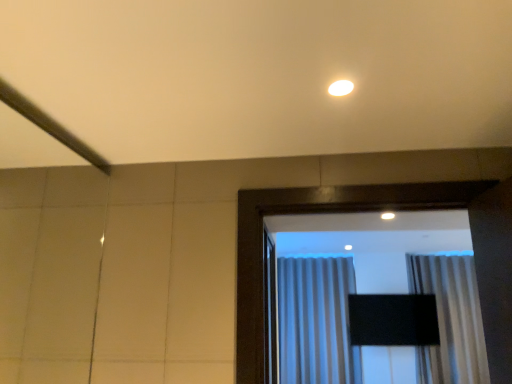
Question: From a real-world perspective, is white glossy light fixture at upper center on gray textured curtain at center, placed as the second curtain when sorted from right to left?

Choices:
 (A) no
 (B) yes

Answer: (B)

Question: Is white glossy light fixture at upper center facing towards gray textured curtain at center, placed as the second curtain when sorted from right to left?

Choices:
 (A) yes
 (B) no

Answer: (B)

Question: Can you confirm if white glossy light fixture at upper center is shorter than gray textured curtain at center, the first curtain from the left?

Choices:
 (A) no
 (B) yes

Answer: (B)

Question: Is white glossy light fixture at upper center at the right side of gray textured curtain at center, the first curtain from the left?

Choices:
 (A) yes
 (B) no

Answer: (B)

Question: Is the surface of white glossy light fixture at upper center in direct contact with gray textured curtain at center, the first curtain from the left?

Choices:
 (A) yes
 (B) no

Answer: (B)

Question: Is white glossy light fixture at upper center closer to the viewer compared to gray textured curtain at center, the first curtain from the left?

Choices:
 (A) no
 (B) yes

Answer: (B)

Question: Can silky white curtain at center, the 1th curtain from the right, be found inside gray textured curtain at center, the first curtain from the left?

Choices:
 (A) no
 (B) yes

Answer: (A)

Question: From the image's perspective, is gray textured curtain at center, the first curtain from the left, over silky white curtain at center, which is the 2th curtain in left-to-right order?

Choices:
 (A) no
 (B) yes

Answer: (A)

Question: Does gray textured curtain at center, the first curtain from the left, have a greater height compared to silky white curtain at center, the 1th curtain from the right?

Choices:
 (A) yes
 (B) no

Answer: (A)

Question: Is gray textured curtain at center, the first curtain from the left, positioned beyond the bounds of silky white curtain at center, which is the 2th curtain in left-to-right order?

Choices:
 (A) no
 (B) yes

Answer: (B)

Question: From the image's perspective, would you say gray textured curtain at center, the first curtain from the left, is shown under silky white curtain at center, which is the 2th curtain in left-to-right order?

Choices:
 (A) yes
 (B) no

Answer: (A)

Question: Considering the relative positions of gray textured curtain at center, placed as the second curtain when sorted from right to left, and silky white curtain at center, which is the 2th curtain in left-to-right order, in the image provided, is gray textured curtain at center, placed as the second curtain when sorted from right to left, to the left of silky white curtain at center, which is the 2th curtain in left-to-right order, from the viewer's perspective?

Choices:
 (A) yes
 (B) no

Answer: (A)

Question: Can you confirm if silky white curtain at center, which is the 2th curtain in left-to-right order, is taller than gray textured curtain at center, placed as the second curtain when sorted from right to left?

Choices:
 (A) no
 (B) yes

Answer: (A)